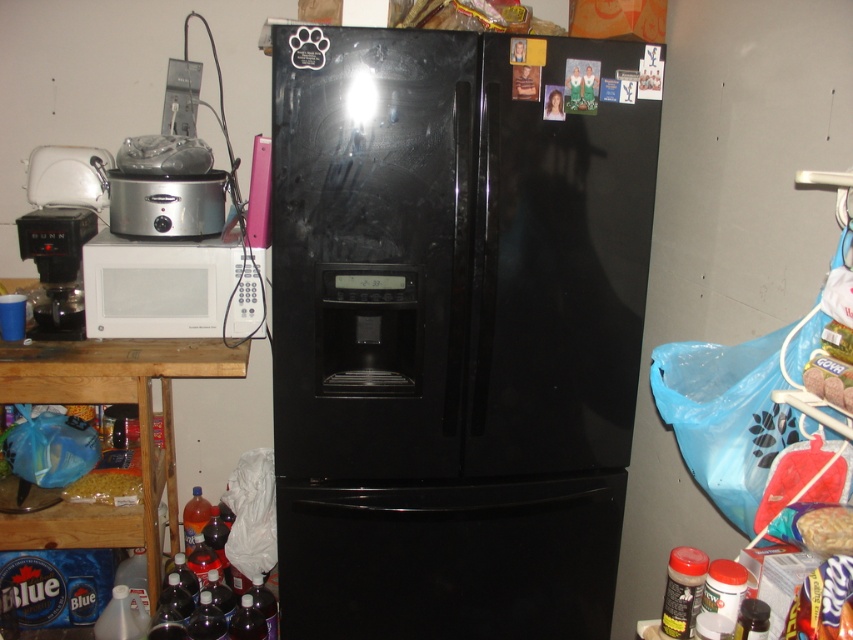
Question: Does black glossy refrigerator at center appear on the right side of white matte microwave at lower left?

Choices:
 (A) no
 (B) yes

Answer: (B)

Question: Considering the real-world distances, which object is closest to the smooth plastic bag at lower right?

Choices:
 (A) matte yellow pasta at lower left
 (B) black glossy refrigerator at center
 (C) black plastic coffee maker at left
 (D) white matte microwave at lower left

Answer: (B)

Question: Considering the real-world distances, which object is closest to the smooth plastic bag at lower right?

Choices:
 (A) black glossy refrigerator at center
 (B) white matte microwave at lower left

Answer: (A)

Question: Based on their relative distances, which object is farther from the black plastic coffee maker at left?

Choices:
 (A) matte yellow pasta at lower left
 (B) smooth plastic bag at lower right
 (C) black glossy refrigerator at center

Answer: (B)

Question: Can you confirm if black plastic coffee maker at left is positioned to the right of matte yellow pasta at lower left?

Choices:
 (A) no
 (B) yes

Answer: (A)

Question: Does black plastic coffee maker at left lie in front of smooth plastic bag at lower right?

Choices:
 (A) no
 (B) yes

Answer: (A)